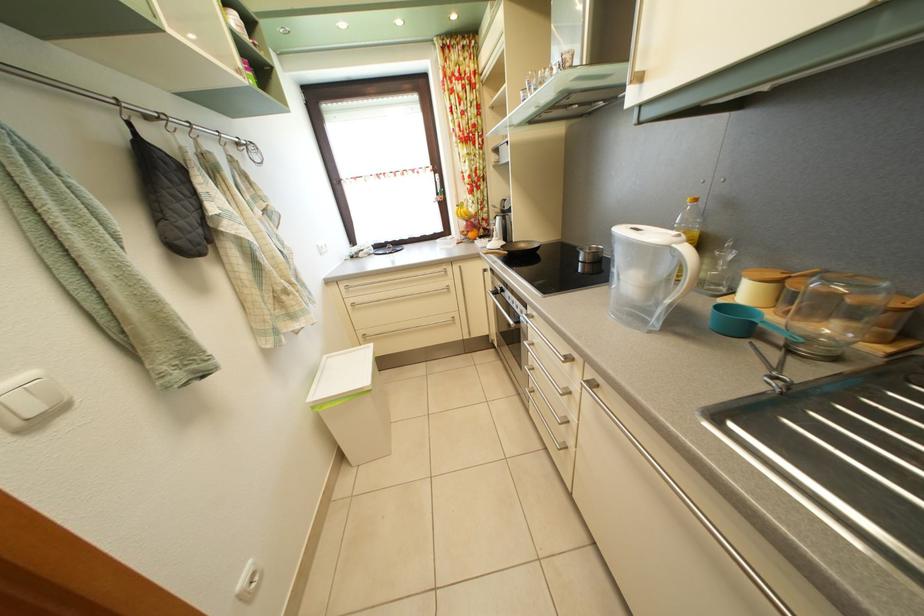
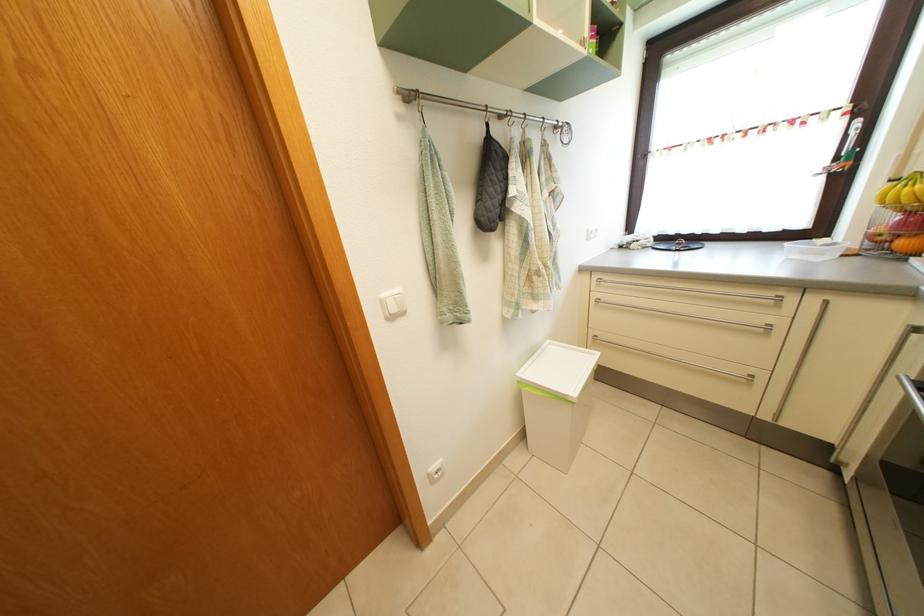
In the second image, find the point that corresponds to (x=358, y=309) in the first image.

(602, 304)